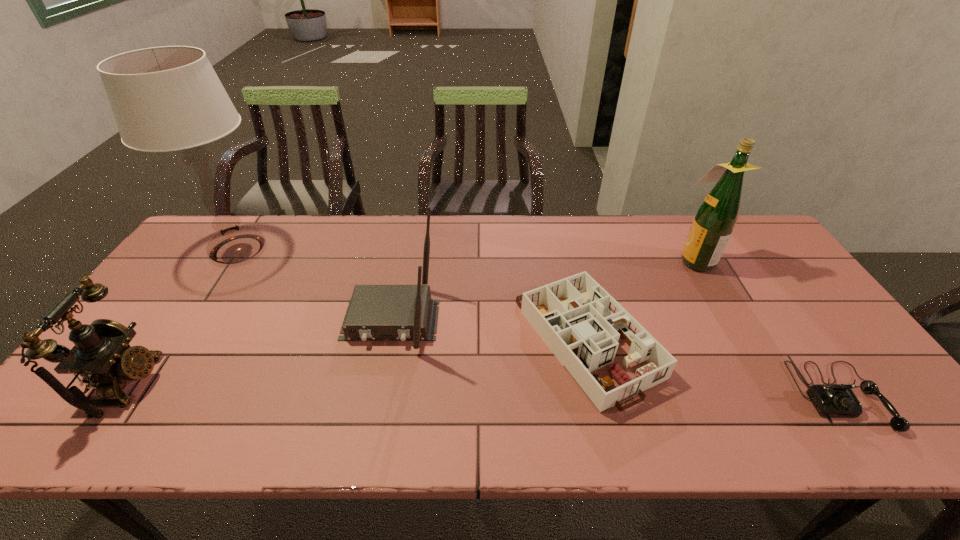
Locate which object is the fourth closest to the taller telephone. Please provide its 2D coordinates. Your answer should be formatted as a tuple, i.e. [(x, y)], where the tuple contains the x and y coordinates of a point satisfying the conditions above.

[(715, 219)]

At what (x,y) coordinates should I click in order to perform the action: click on vacant space that satisfies the following two spatial constraints: 1. on the back of the dollhouse to connect cables; 2. on the left side of the router. Please return your answer as a coordinate pair (x, y). Looking at the image, I should click on (387, 339).

This screenshot has width=960, height=540. Identify the location of vacant space that satisfies the following two spatial constraints: 1. on the back of the third object from left to right to connect cables; 2. on the right side of the dollhouse. (387, 339).

I want to click on vacant area that satisfies the following two spatial constraints: 1. on the back of the router to connect cables; 2. on the left side of the dollhouse, so click(x=387, y=339).